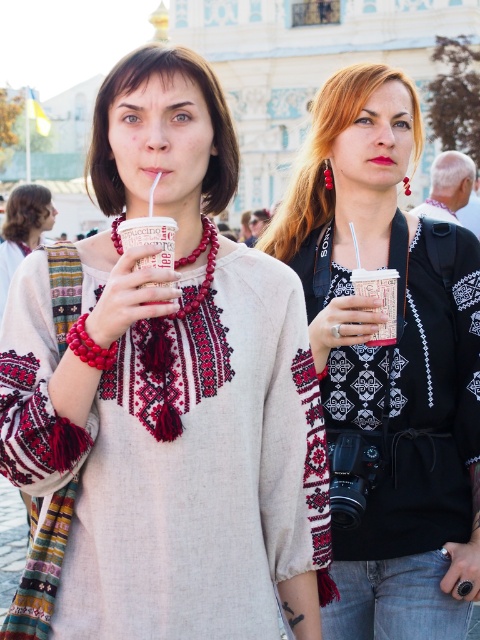
You are standing at the center of the image and want to pick up the closest cup between the matte white cup at center and the white paper cup at center. Which one should you choose?

The matte white cup at center is 36.64 feet away from the white paper cup at center. Since you are at the center, both cups are equally distant from you. Therefore, you can choose either one as they are the same distance away.

You are a barista who needs to prepare a drink for a customer. The customer wants a cup that is not too small. Looking at the image, which object would you choose between the matte white cup at center and the matte black scarf at center?

The matte white cup at center has a smaller size compared to matte black scarf at center. Therefore, the matte black scarf at center is larger, so the barista should choose the matte black scarf at center to ensure the cup is not too small.

You are a barista preparing drinks for customers. You have a matte white cup at center and a matte black scarf at center in front of you. Which item is wider?

The matte white cup at center is wider than the matte black scarf at center according to the description.